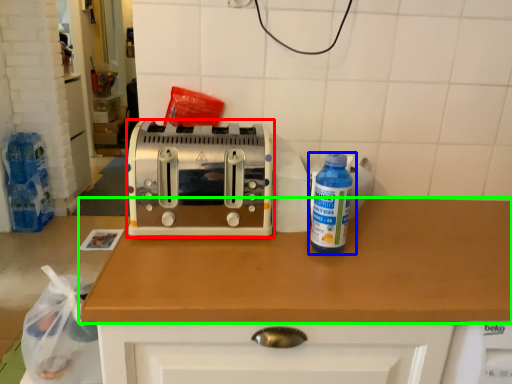
Question: Which object is positioned farthest from toaster (highlighted by a red box)? Select from bottle (highlighted by a blue box) and countertop (highlighted by a green box).

Choices:
 (A) bottle
 (B) countertop

Answer: (A)